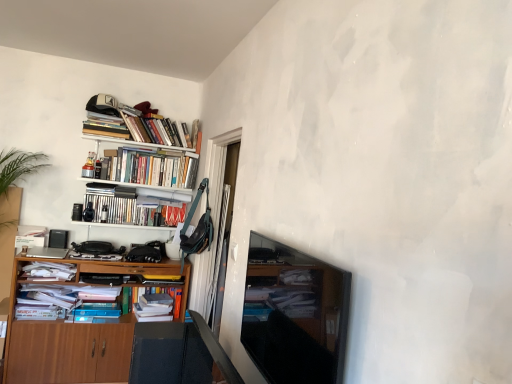
Describe the element at coordinates (294, 314) in the screenshot. I see `matte black tv at center` at that location.

How much space does hardcover books at upper left, marked as the third book in a top-to-bottom arrangement, occupy horizontally?

hardcover books at upper left, marked as the third book in a top-to-bottom arrangement, is 9.92 inches in width.

Image resolution: width=512 pixels, height=384 pixels. What do you see at coordinates (138, 124) in the screenshot? I see `hardcover books at upper left, which is the second book from top to bottom` at bounding box center [138, 124].

Find the location of a particular element. The width and height of the screenshot is (512, 384). hardcover books at upper left, which is the second book from top to bottom is located at coordinates (138, 124).

Identify the location of hardcover books at upper left, marked as the 4th book in a top-to-bottom arrangement. This screenshot has height=384, width=512. (129, 207).

Find the location of a particular element. The width and height of the screenshot is (512, 384). wooden cabinet at left is located at coordinates (65, 348).

From a real-world perspective, is hardcover books at upper left, marked as the third book in a top-to-bottom arrangement, over hardcover books at upper left, which is the second book from top to bottom?

Actually, hardcover books at upper left, marked as the third book in a top-to-bottom arrangement, is physically below hardcover books at upper left, which is the second book from top to bottom, in the real world.

Could you tell me if hardcover books at upper left, the third book from the bottom, is turned towards hardcover books at upper left, which is the second book from top to bottom?

No, hardcover books at upper left, the third book from the bottom, is not facing towards hardcover books at upper left, which is the second book from top to bottom.

Is hardcover books at upper left, the third book from the bottom, bigger than hardcover books at upper left, which is the second book from top to bottom?

Indeed, hardcover books at upper left, the third book from the bottom, has a larger size compared to hardcover books at upper left, which is the second book from top to bottom.

Is hardcover books at upper left, marked as the third book in a top-to-bottom arrangement, next to hardcover books at upper left, placed as the fourth book when sorted from bottom to top?

No, hardcover books at upper left, marked as the third book in a top-to-bottom arrangement, is not making contact with hardcover books at upper left, placed as the fourth book when sorted from bottom to top.

Between white paper magazine at left and hardcover books at upper left, which is the 2th book from bottom to top, which one has more height?

hardcover books at upper left, which is the 2th book from bottom to top, is taller.

From a real-world perspective, is white paper magazine at left physically above hardcover books at upper left, which is the 2th book from bottom to top?

Incorrect, from a real-world perspective, white paper magazine at left is lower than hardcover books at upper left, which is the 2th book from bottom to top.

Is white paper magazine at left at the right side of hardcover books at upper left, marked as the 4th book in a top-to-bottom arrangement?

No.

How different are the orientations of white matte bookshelf at upper left and hardcover books at center, the 1th book ordered from the bottom, in degrees?

1.71 degrees separate the facing orientations of white matte bookshelf at upper left and hardcover books at center, the 1th book ordered from the bottom.

Is white matte bookshelf at upper left oriented away from hardcover books at center, the 1th book ordered from the bottom?

No, hardcover books at center, the 1th book ordered from the bottom, is not at the back of white matte bookshelf at upper left.

Based on the photo, is white matte bookshelf at upper left surrounding hardcover books at center, the 1th book ordered from the bottom?

No, hardcover books at center, the 1th book ordered from the bottom, is not inside white matte bookshelf at upper left.

Is white matte bookshelf at upper left next to hardcover books at center, the 1th book ordered from the bottom?

white matte bookshelf at upper left and hardcover books at center, the 1th book ordered from the bottom, are not in contact.

Is wooden cabinet at left to the right of hardcover books at upper left, which is the second book from top to bottom, from the viewer's perspective?

No.

How many degrees apart are the facing directions of wooden cabinet at left and hardcover books at upper left, placed as the fourth book when sorted from bottom to top?

The angular difference between wooden cabinet at left and hardcover books at upper left, placed as the fourth book when sorted from bottom to top, is 1.71 degrees.

Between wooden cabinet at left and hardcover books at upper left, which is the second book from top to bottom, which one is positioned in front?

wooden cabinet at left is in front.

Does point (8, 315) come closer to viewer compared to point (112, 129)?

Yes, point (8, 315) is in front of point (112, 129).

From the image's perspective, is wooden cabinet at left beneath hardcover books at upper left, which is counted as the fifth book, starting from the bottom?

Correct, wooden cabinet at left appears lower than hardcover books at upper left, which is counted as the fifth book, starting from the bottom, in the image.

Can you tell me how much wooden cabinet at left and hardcover books at upper left, the first book when ordered from top to bottom, differ in facing direction?

1.71 degrees.

Is wooden cabinet at left further to the viewer compared to hardcover books at upper left, the first book when ordered from top to bottom?

No, it is in front of hardcover books at upper left, the first book when ordered from top to bottom.

Which is more to the right, hardcover books at upper left, marked as the third book in a top-to-bottom arrangement, or transparent glass door at center?

transparent glass door at center.

Considering the relative sizes of hardcover books at upper left, marked as the third book in a top-to-bottom arrangement, and transparent glass door at center in the image provided, is hardcover books at upper left, marked as the third book in a top-to-bottom arrangement, shorter than transparent glass door at center?

Yes, hardcover books at upper left, marked as the third book in a top-to-bottom arrangement, is shorter than transparent glass door at center.

From a real-world perspective, is hardcover books at upper left, the third book from the bottom, over transparent glass door at center?

Yes.

From the image's perspective, is hardcover books at upper left, marked as the third book in a top-to-bottom arrangement, on transparent glass door at center?

Indeed, from the image's perspective, hardcover books at upper left, marked as the third book in a top-to-bottom arrangement, is shown above transparent glass door at center.

Does wooden cabinet at left have a greater width compared to matte black tv at center?

Indeed, wooden cabinet at left has a greater width compared to matte black tv at center.

Is wooden cabinet at left aimed at matte black tv at center?

Yes.

From a real-world perspective, is wooden cabinet at left positioned above or below matte black tv at center?

In terms of real-world spatial position, wooden cabinet at left is below matte black tv at center.

Considering the positions of objects wooden cabinet at left and matte black tv at center in the image provided, who is more to the left, wooden cabinet at left or matte black tv at center?

wooden cabinet at left.

What are the coordinates of `the 2nd book located beneath the hardcover books at upper left, placed as the fourth book when sorted from bottom to top (from a real-world perspective)` in the screenshot? It's located at (147, 168).

Locate an element on the screen. the 2nd book counting from the right side of the white paper magazine at left is located at coordinates (129, 207).

From the picture: Considering their positions, is white paper magazine at left positioned closer to hardcover books at upper left, the first book when ordered from top to bottom, than transparent glass door at center?

The object closer to hardcover books at upper left, the first book when ordered from top to bottom, is transparent glass door at center.

From the image, which object appears to be nearer to matte black tv at center, transparent glass door at center or hardcover books at center, the 1th book ordered from the bottom?

The object closer to matte black tv at center is transparent glass door at center.

In the scene shown: Which object lies further to the anchor point hardcover books at center, which is counted as the fifth book, starting from the top, hardcover books at upper left, the third book from the bottom, or transparent glass door at center?

Based on the image, hardcover books at upper left, the third book from the bottom, appears to be further to hardcover books at center, which is counted as the fifth book, starting from the top.

From the image, which object appears to be nearer to transparent glass door at center, matte black tv at center or wooden cabinet at left?

wooden cabinet at left.

From the image, which object appears to be nearer to hardcover books at center, the 1th book ordered from the bottom, white paper magazine at left or transparent glass door at center?

The object closer to hardcover books at center, the 1th book ordered from the bottom, is transparent glass door at center.

Considering their positions, is hardcover books at upper left, which is counted as the fifth book, starting from the bottom, positioned further to hardcover books at center, the 1th book ordered from the bottom, than white matte bookshelf at upper left?

hardcover books at upper left, which is counted as the fifth book, starting from the bottom, lies further to hardcover books at center, the 1th book ordered from the bottom, than the other object.

From the image, which object appears to be nearer to hardcover books at upper left, which is the 2th book from bottom to top, wooden cabinet at left or hardcover books at center, which is counted as the fifth book, starting from the top?

wooden cabinet at left is closer to hardcover books at upper left, which is the 2th book from bottom to top.

When comparing their distances from matte black tv at center, does hardcover books at upper left, marked as the third book in a top-to-bottom arrangement, or transparent glass door at center seem further?

hardcover books at upper left, marked as the third book in a top-to-bottom arrangement, lies further to matte black tv at center than the other object.

The image size is (512, 384). I want to click on glass door between hardcover books at upper left, placed as the fourth book when sorted from bottom to top, and wooden cabinet at left vertically, so click(216, 223).

The image size is (512, 384). I want to click on glass door between hardcover books at upper left, the third book from the bottom, and hardcover books at center, which is counted as the fifth book, starting from the top, from top to bottom, so click(x=216, y=223).

Identify the location of magazine between hardcover books at upper left, marked as the third book in a top-to-bottom arrangement, and wooden cabinet at left, in the vertical direction. (50, 270).

Locate an element on the screen. glass door located between matte black tv at center and white paper magazine at left in the depth direction is located at coordinates (216, 223).